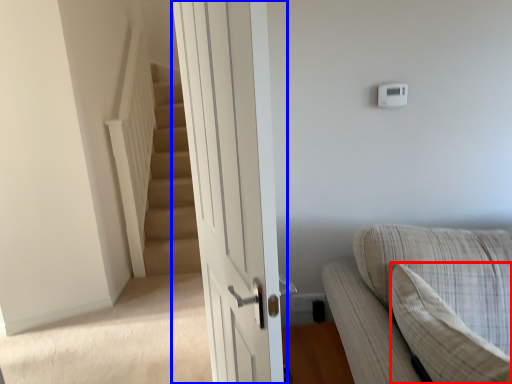
Question: Which object appears farthest to the camera in this image, pillow (highlighted by a red box) or door (highlighted by a blue box)?

Choices:
 (A) pillow
 (B) door

Answer: (A)